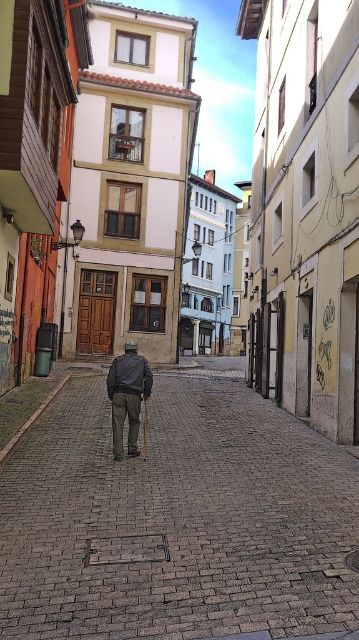
Question: Does brown brick pavement at center have a greater width compared to dark gray fabric jacket at center?

Choices:
 (A) yes
 (B) no

Answer: (A)

Question: Among these objects, which one is farthest from the camera?

Choices:
 (A) brown brick pavement at center
 (B) dark gray fabric jacket at center

Answer: (B)

Question: Is brown brick pavement at center positioned at the back of dark gray fabric jacket at center?

Choices:
 (A) yes
 (B) no

Answer: (B)

Question: Can you confirm if brown brick pavement at center is positioned to the left of dark gray fabric jacket at center?

Choices:
 (A) yes
 (B) no

Answer: (B)